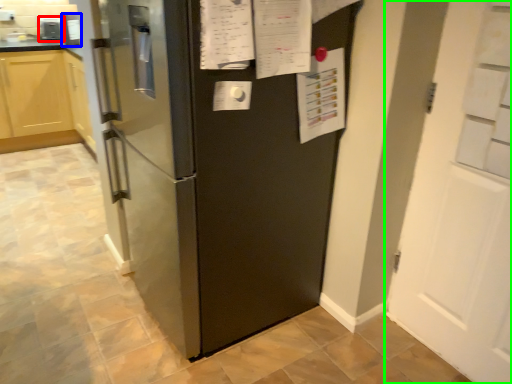
Question: Considering the real-world distances, which object is closest to appliance (highlighted by a red box)? appliance (highlighted by a blue box) or door (highlighted by a green box).

Choices:
 (A) appliance
 (B) door

Answer: (A)